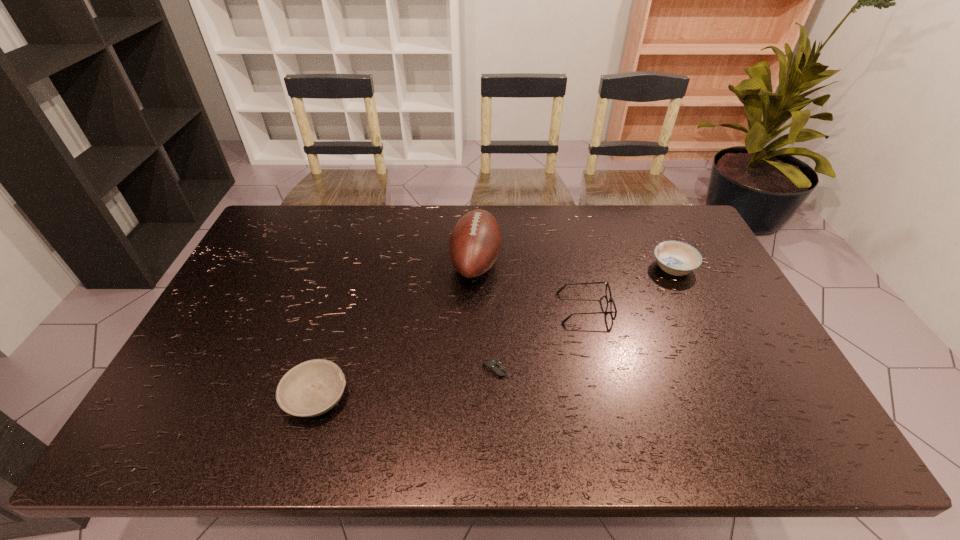
Locate an element on the screen. The image size is (960, 540). vacant space at the right edge of the desktop is located at coordinates (741, 305).

Locate an element on the screen. vacant space at the far left corner of the desktop is located at coordinates (308, 222).

This screenshot has height=540, width=960. In order to click on blank space at the far right corner in this screenshot , I will do `click(645, 220)`.

Locate an element on the screen. This screenshot has width=960, height=540. vacant point located between the tallest object and the spectacles is located at coordinates (530, 285).

Where is `free point between the computer mouse and the right bowl`? The image size is (960, 540). free point between the computer mouse and the right bowl is located at coordinates (585, 319).

Image resolution: width=960 pixels, height=540 pixels. What are the coordinates of `unoccupied area between the leftmost object and the shortest object` in the screenshot? It's located at point(406,383).

The height and width of the screenshot is (540, 960). I want to click on vacant region between the football (American) and the shortest object, so click(486, 316).

The image size is (960, 540). I want to click on free area in between the fourth object from left to right and the left bowl, so click(450, 352).

At what (x,y) coordinates should I click in order to perform the action: click on empty space that is in between the rightmost object and the second object from right to left. Please return your answer as a coordinate pair (x, y). Looking at the image, I should click on (629, 288).

At what (x,y) coordinates should I click in order to perform the action: click on free space between the tallest object and the farther bowl. Please return your answer as a coordinate pair (x, y). This screenshot has width=960, height=540. Looking at the image, I should click on (574, 265).